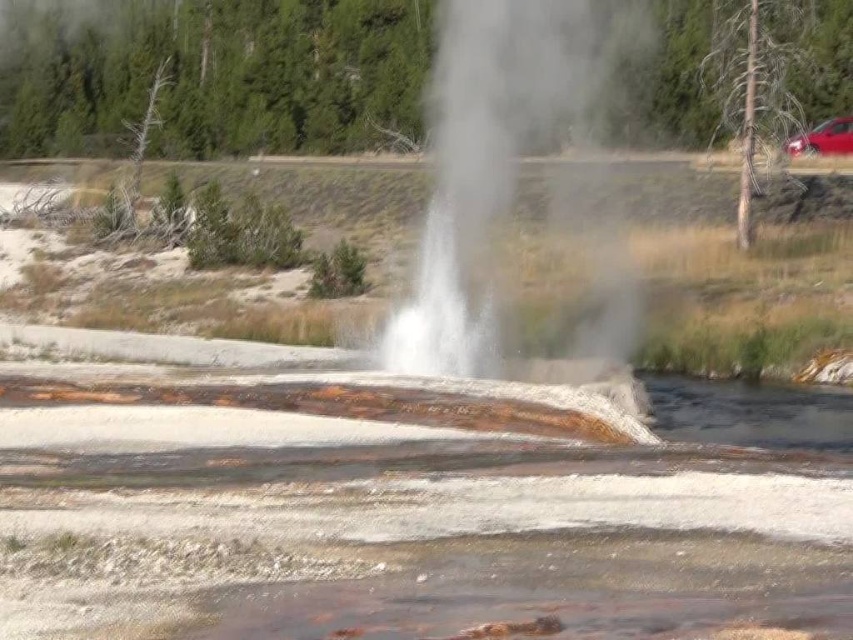
Question: Which object is positioned closest to the white textured water at center?

Choices:
 (A) metallic red car at right
 (B) white vapor at center

Answer: (B)

Question: Can you confirm if white textured water at center is thinner than white vapor at center?

Choices:
 (A) no
 (B) yes

Answer: (A)

Question: Among these points, which one is nearest to the camera?

Choices:
 (A) (833, 148)
 (B) (171, 636)
 (C) (428, 308)

Answer: (B)

Question: Considering the real-world distances, which object is closest to the white vapor at center?

Choices:
 (A) metallic red car at right
 (B) white textured water at center

Answer: (B)

Question: Can you confirm if white vapor at center is smaller than metallic red car at right?

Choices:
 (A) no
 (B) yes

Answer: (A)

Question: Considering the relative positions of white textured water at center and white vapor at center in the image provided, where is white textured water at center located with respect to white vapor at center?

Choices:
 (A) right
 (B) left

Answer: (B)